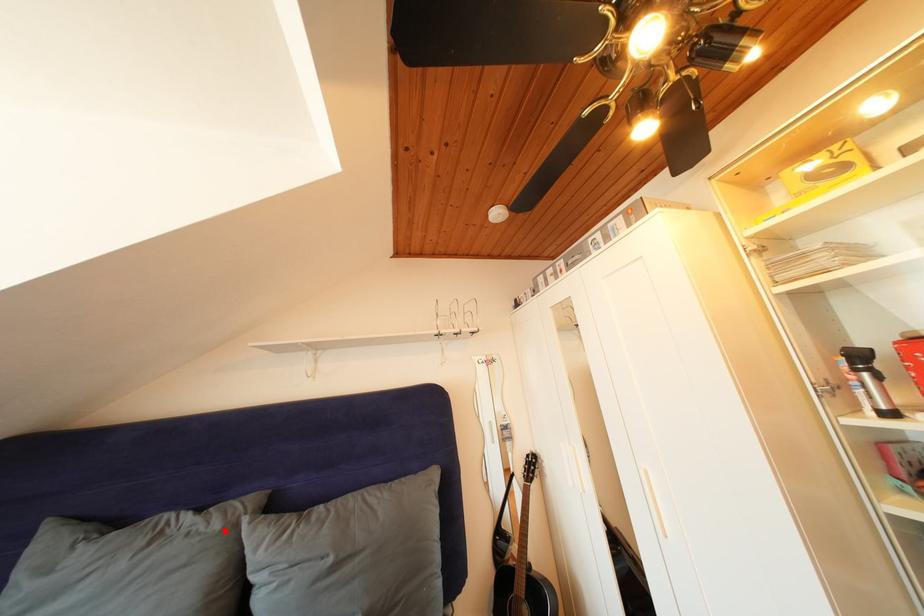
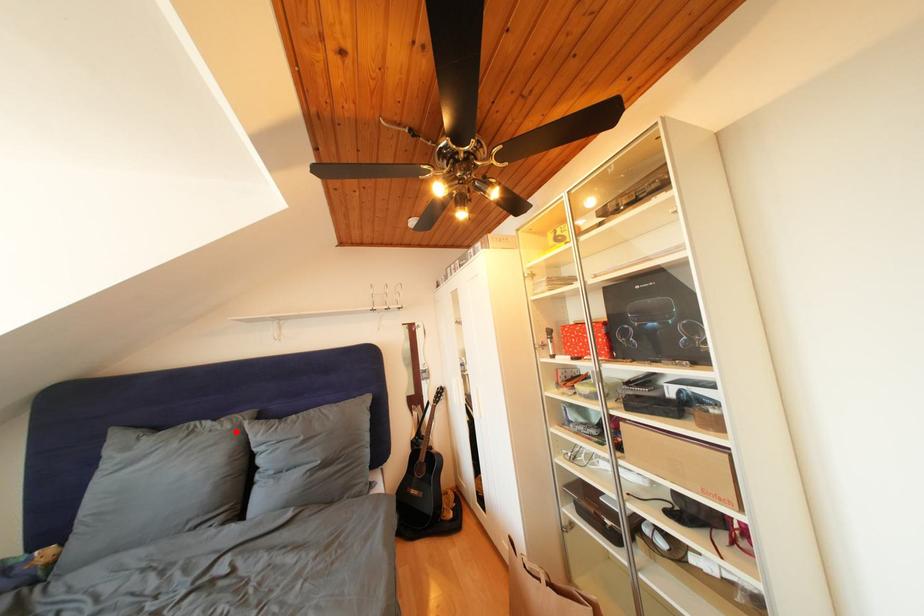
I am providing you with two images of the same scene from different viewpoints. A red point is marked on the first image and another point is marked on the second image. Do the highlighted points in image1 and image2 indicate the same real-world spot?

Yes